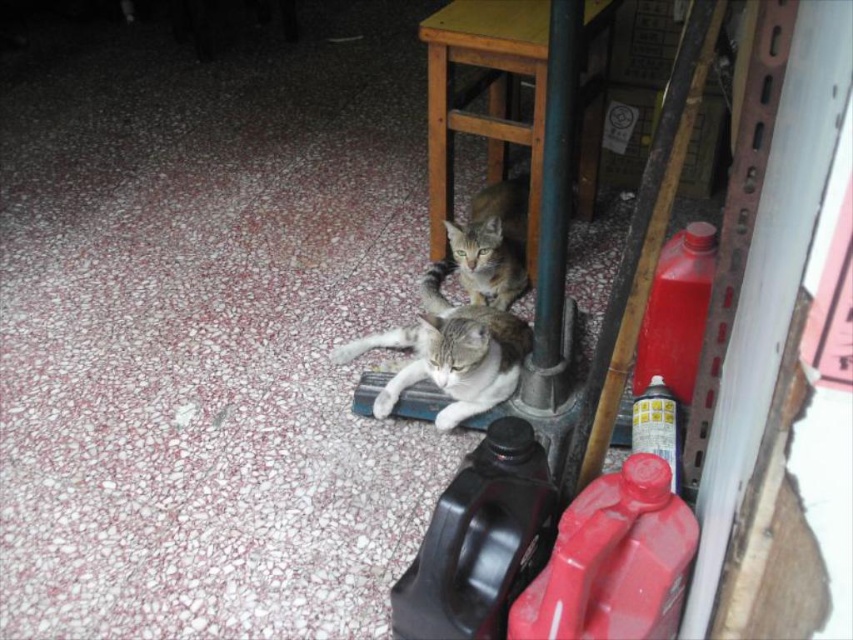
Question: Does wooden table at upper center appear on the right side of tabby fur cat at center?

Choices:
 (A) no
 (B) yes

Answer: (B)

Question: Among these points, which one is farthest from the camera?

Choices:
 (A) (486, 221)
 (B) (381, 413)

Answer: (A)

Question: Which object appears farthest from the camera in this image?

Choices:
 (A) wooden table at upper center
 (B) tabby fur cat at center

Answer: (B)

Question: Is wooden table at upper center above tabby fur cat at center?

Choices:
 (A) no
 (B) yes

Answer: (B)

Question: Which object is positioned farthest from the wooden table at upper center?

Choices:
 (A) gray tabby cat at center
 (B) tabby fur cat at center

Answer: (A)

Question: Does gray tabby cat at center have a smaller size compared to tabby fur cat at center?

Choices:
 (A) no
 (B) yes

Answer: (A)